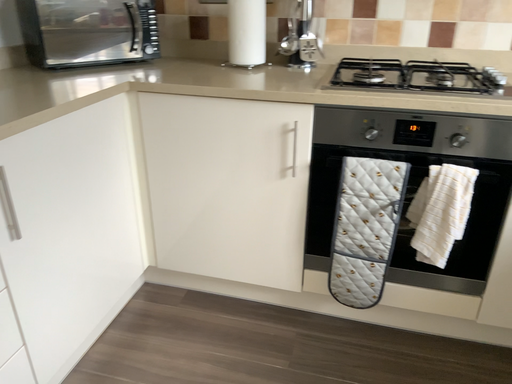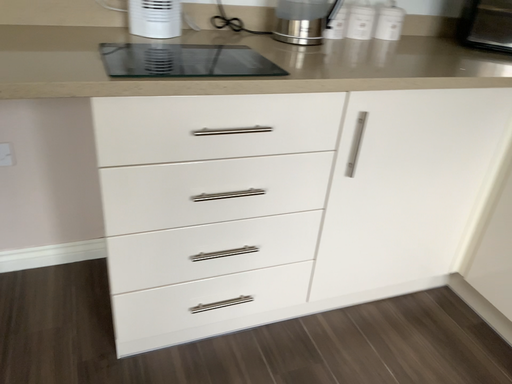
Question: Which way did the camera rotate in the video?

Choices:
 (A) rotated upward
 (B) rotated downward

Answer: (A)